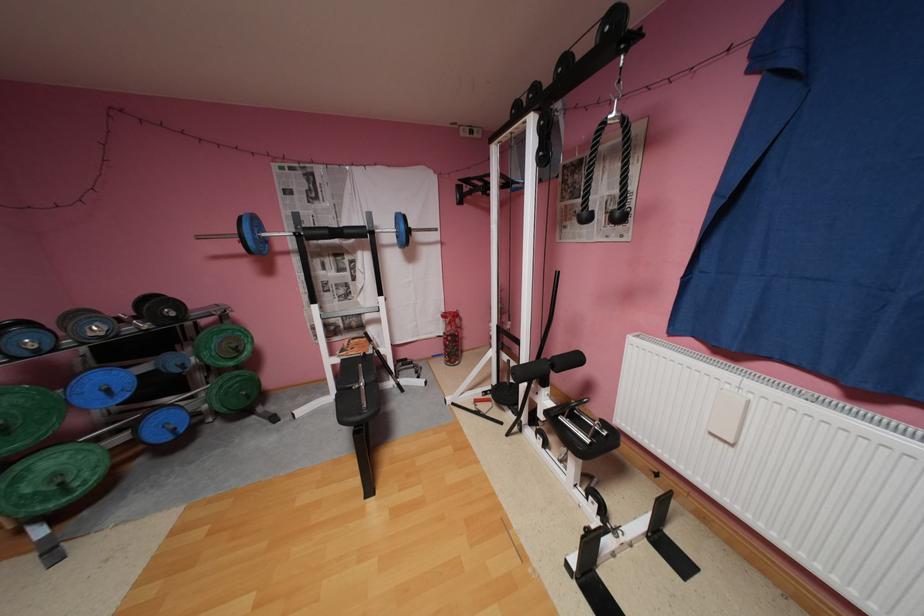
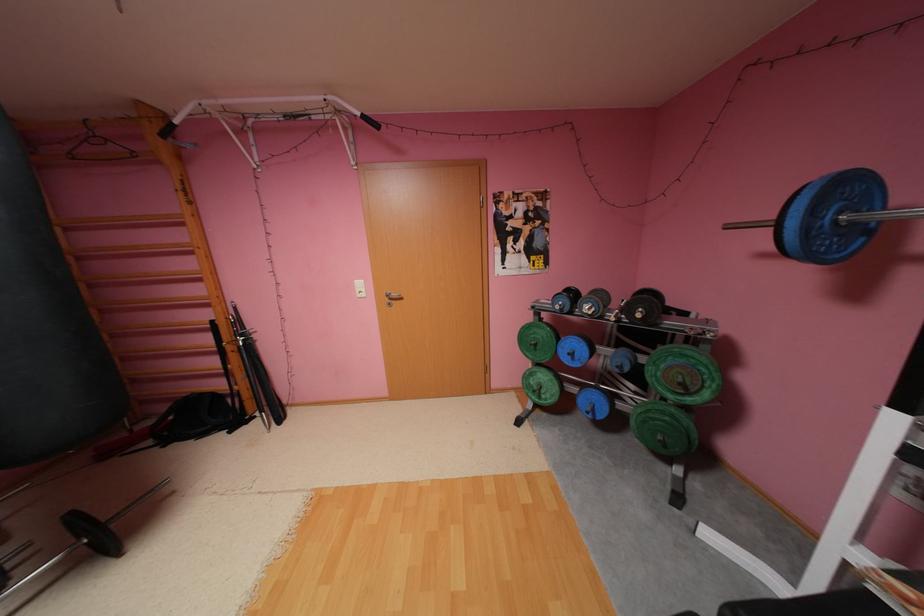
Locate, in the second image, the point that corresponds to pixel 263 238 in the first image.

(816, 229)